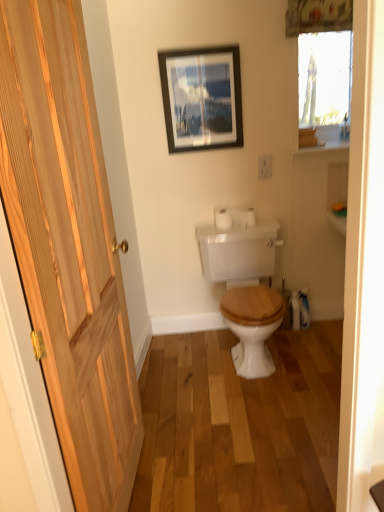
Question: Is matte black picture frame at upper center next to floral fabric curtain at upper center?

Choices:
 (A) no
 (B) yes

Answer: (A)

Question: Can you confirm if matte black picture frame at upper center is bigger than floral fabric curtain at upper center?

Choices:
 (A) no
 (B) yes

Answer: (B)

Question: From the image's perspective, does matte black picture frame at upper center appear lower than floral fabric curtain at upper center?

Choices:
 (A) yes
 (B) no

Answer: (A)

Question: Is floral fabric curtain at upper center at the back of matte black picture frame at upper center?

Choices:
 (A) yes
 (B) no

Answer: (B)

Question: Is matte black picture frame at upper center taller than floral fabric curtain at upper center?

Choices:
 (A) yes
 (B) no

Answer: (A)

Question: Is the position of matte black picture frame at upper center more distant than that of floral fabric curtain at upper center?

Choices:
 (A) no
 (B) yes

Answer: (B)

Question: From the image's perspective, is white matte toilet paper at center located beneath floral fabric curtain at upper center?

Choices:
 (A) yes
 (B) no

Answer: (A)

Question: Considering the relative sizes of white matte toilet paper at center and floral fabric curtain at upper center in the image provided, is white matte toilet paper at center wider than floral fabric curtain at upper center?

Choices:
 (A) no
 (B) yes

Answer: (B)

Question: Are white matte toilet paper at center and floral fabric curtain at upper center far apart?

Choices:
 (A) yes
 (B) no

Answer: (A)

Question: Can you confirm if white matte toilet paper at center is smaller than floral fabric curtain at upper center?

Choices:
 (A) no
 (B) yes

Answer: (B)

Question: Considering the relative sizes of white matte toilet paper at center and floral fabric curtain at upper center in the image provided, is white matte toilet paper at center taller than floral fabric curtain at upper center?

Choices:
 (A) no
 (B) yes

Answer: (A)

Question: Considering the relative sizes of white matte toilet paper at center and floral fabric curtain at upper center in the image provided, is white matte toilet paper at center shorter than floral fabric curtain at upper center?

Choices:
 (A) no
 (B) yes

Answer: (B)

Question: Is floral fabric curtain at upper center oriented towards natural wood door at left?

Choices:
 (A) no
 (B) yes

Answer: (A)